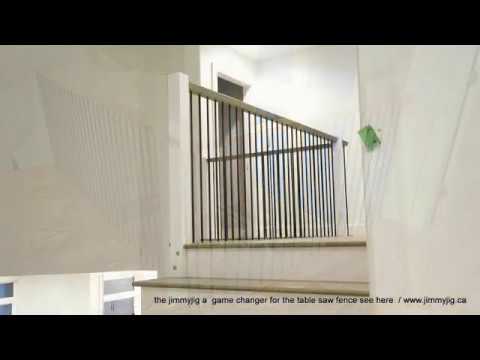
This screenshot has width=480, height=360. I want to click on metal balustrade ofat top of staircase, so click(279, 183), click(232, 153).